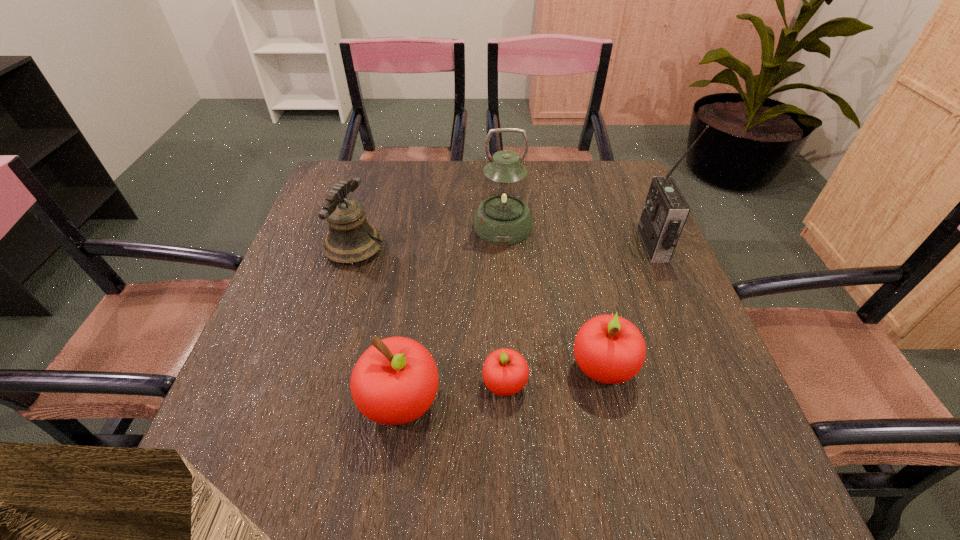
At what (x,y) coordinates should I click in order to perform the action: click on vacant space at the far edge. Please return your answer as a coordinate pair (x, y). Image resolution: width=960 pixels, height=540 pixels. Looking at the image, I should click on (539, 173).

Find the location of `vacant space at the near edge`. vacant space at the near edge is located at coordinates (510, 398).

Find the location of a particular element. vacant space at the right edge of the desktop is located at coordinates pos(615,285).

Locate an element on the screen. The image size is (960, 540). free space at the far left corner of the desktop is located at coordinates (372, 182).

The width and height of the screenshot is (960, 540). Find the location of `vacant region at the near left corner of the desktop`. vacant region at the near left corner of the desktop is located at coordinates (245, 427).

The height and width of the screenshot is (540, 960). In the image, there is a desktop. Identify the location of free region at the far right corner. (622, 177).

Image resolution: width=960 pixels, height=540 pixels. Identify the location of free space at the near right corner of the desktop. (714, 410).

Image resolution: width=960 pixels, height=540 pixels. What are the coordinates of `vacant space in between the fifth shortest object and the fifth object from right to left` in the screenshot? It's located at (452, 314).

At what (x,y) coordinates should I click in order to perform the action: click on free space between the second shortest apple and the lantern. Please return your answer as a coordinate pair (x, y). This screenshot has width=960, height=540. Looking at the image, I should click on (553, 296).

Identify the location of empty location between the second apple from right to left and the bell. Image resolution: width=960 pixels, height=540 pixels. (429, 316).